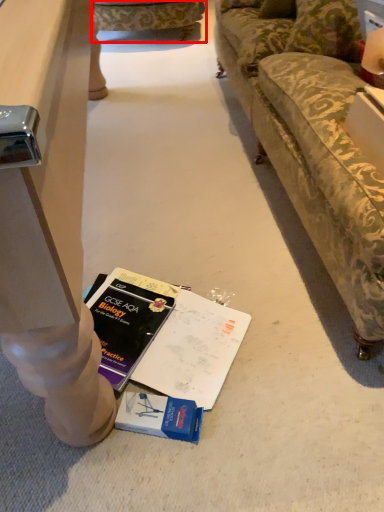
Question: From the image's perspective, what is the correct spatial relationship of studio couch (annotated by the red box) in relation to pillow?

Choices:
 (A) above
 (B) below

Answer: (A)